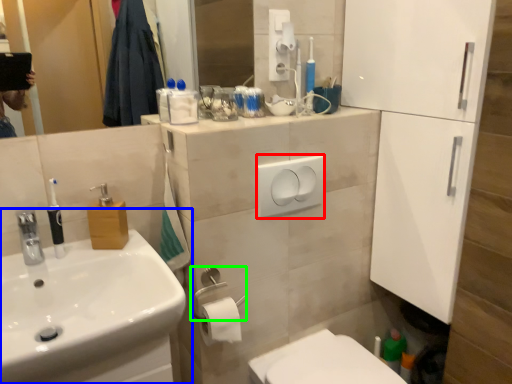
Question: Considering the real-world distances, which object is closest to light switch (highlighted by a red box)? sink (highlighted by a blue box) or towel bar (highlighted by a green box).

Choices:
 (A) sink
 (B) towel bar

Answer: (B)